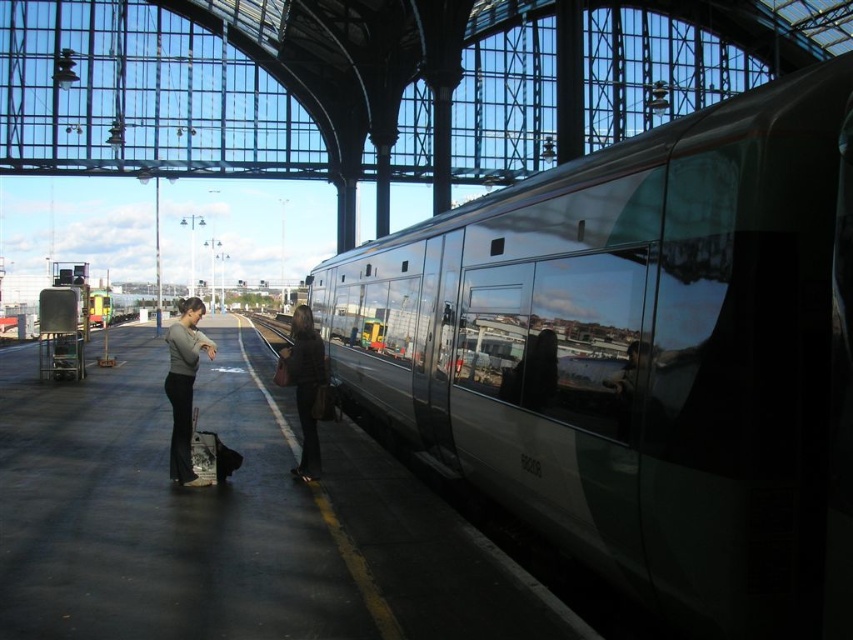
Is smooth concrete platform at center behind dark brown leather jacket at center?

No.

Looking at this image, who is lower down, smooth concrete platform at center or dark brown leather jacket at center?

Positioned lower is smooth concrete platform at center.

This screenshot has width=853, height=640. I want to click on smooth concrete platform at center, so click(229, 520).

Does point (463, 369) come farther from viewer compared to point (325, 432)?

No, (463, 369) is in front of (325, 432).

In the scene shown: Is shiny metallic train at right wider than smooth concrete platform at center?

In fact, shiny metallic train at right might be narrower than smooth concrete platform at center.

Does point (775, 556) come farther from viewer compared to point (467, 577)?

No, (775, 556) is in front of (467, 577).

I want to click on shiny metallic train at right, so click(643, 355).

Locate an element on the screen. The width and height of the screenshot is (853, 640). shiny metallic train at right is located at coordinates (643, 355).

You are a GUI agent. You are given a task and a screenshot of the screen. Output one action in this format:
    pyautogui.click(x=<x>, y=<y>)
    Task: Click on the shiny metallic train at right
    The width and height of the screenshot is (853, 640).
    Given the screenshot: What is the action you would take?
    pyautogui.click(x=643, y=355)

Where is `shiny metallic train at right`? shiny metallic train at right is located at coordinates (643, 355).